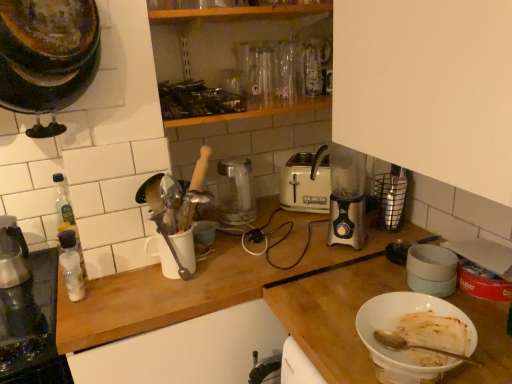
At what (x,y) coordinates should I click in order to perform the action: click on vacant space to the right of clear plastic bottle at left, the second bottle in the back-to-front sequence. Please return your answer as a coordinate pair (x, y). Image resolution: width=512 pixels, height=384 pixels. Looking at the image, I should click on (124, 288).